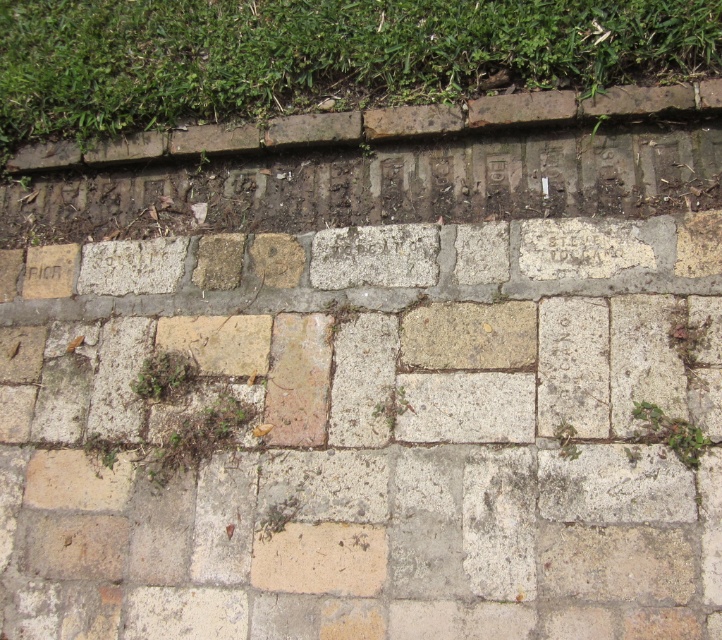
Question: Which object is the closest to the green grass at upper center?

Choices:
 (A) light brown stone brick at center
 (B) green leafy weed at center

Answer: (A)

Question: Among these points, which one is farthest from the camera?

Choices:
 (A) (439, 304)
 (B) (131, 387)
 (C) (679, 422)

Answer: (B)

Question: Does green grass at upper center have a smaller size compared to green mossy weed at center?

Choices:
 (A) no
 (B) yes

Answer: (A)

Question: From the image, what is the correct spatial relationship of green grass at upper center in relation to light brown stone brick at center?

Choices:
 (A) left
 (B) right

Answer: (A)

Question: Which point is farther to the camera?

Choices:
 (A) natural stone pavement at center
 (B) green mossy patch at center

Answer: (B)

Question: Where is light brown stone brick at center located in relation to green mossy patch at center in the image?

Choices:
 (A) right
 (B) left

Answer: (B)